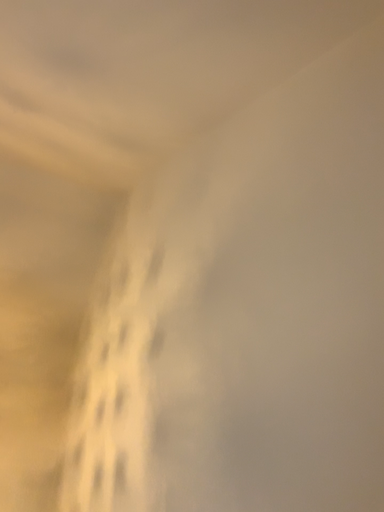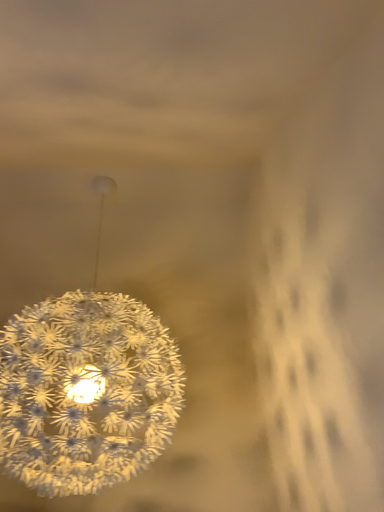
Question: Which way did the camera rotate in the video?

Choices:
 (A) rotated right
 (B) rotated left

Answer: (B)